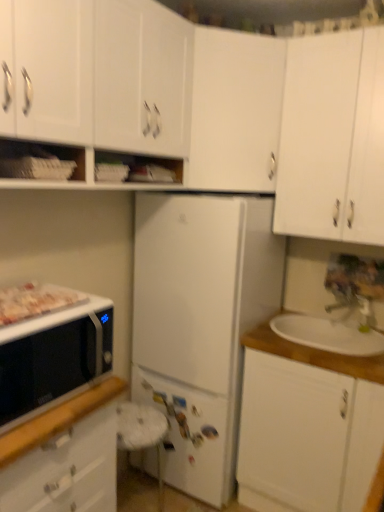
At what (x,y) coordinates should I click in order to perform the action: click on vacant space that is to the left of metallic silver faucet at upper right. Please return your answer as a coordinate pair (x, y). The image size is (384, 512). Looking at the image, I should click on (314, 323).